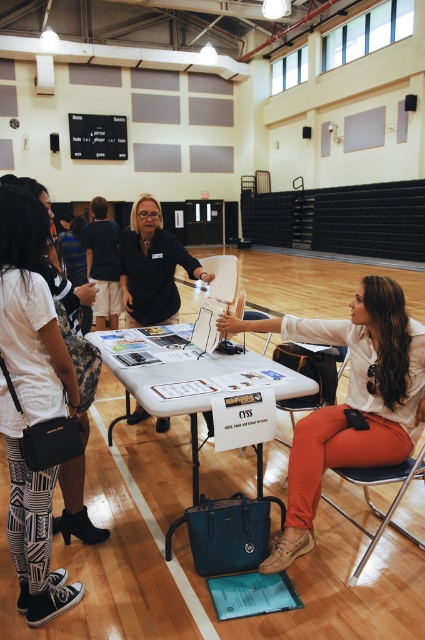
Where is `white plastic table at center`? This screenshot has height=640, width=425. white plastic table at center is located at coordinates (187, 380).

Who is more distant from viewer, (x=144, y=372) or (x=152, y=268)?

The point (x=152, y=268) is more distant.

At what (x,y) coordinates should I click in order to perform the action: click on white plastic table at center. Please return your answer as a coordinate pair (x, y). The height and width of the screenshot is (640, 425). Looking at the image, I should click on [187, 380].

At what (x,y) coordinates should I click in order to perform the action: click on white plastic table at center. Please return your answer as a coordinate pair (x, y). Looking at the image, I should click on (187, 380).

Is the position of white printed leggings at lower left less distant than that of metallic silver chair at lower center?

Yes, it is.

Can you confirm if white printed leggings at lower left is positioned to the right of metallic silver chair at lower center?

Incorrect, white printed leggings at lower left is not on the right side of metallic silver chair at lower center.

Identify the location of white printed leggings at lower left. This screenshot has height=640, width=425. point(31,401).

At what (x,y) coordinates should I click in order to perform the action: click on white printed leggings at lower left. Please return your answer as a coordinate pair (x, y). The height and width of the screenshot is (640, 425). Looking at the image, I should click on (31, 401).

Who is lower down, white matte shirt at center or matte black shirt at center?

white matte shirt at center

Based on the photo, is white matte shirt at center in front of matte black shirt at center?

That is True.

This screenshot has width=425, height=640. What are the coordinates of `white matte shirt at center` in the screenshot? It's located at (351, 401).

Locate an element on the screen. white matte shirt at center is located at coordinates (351, 401).